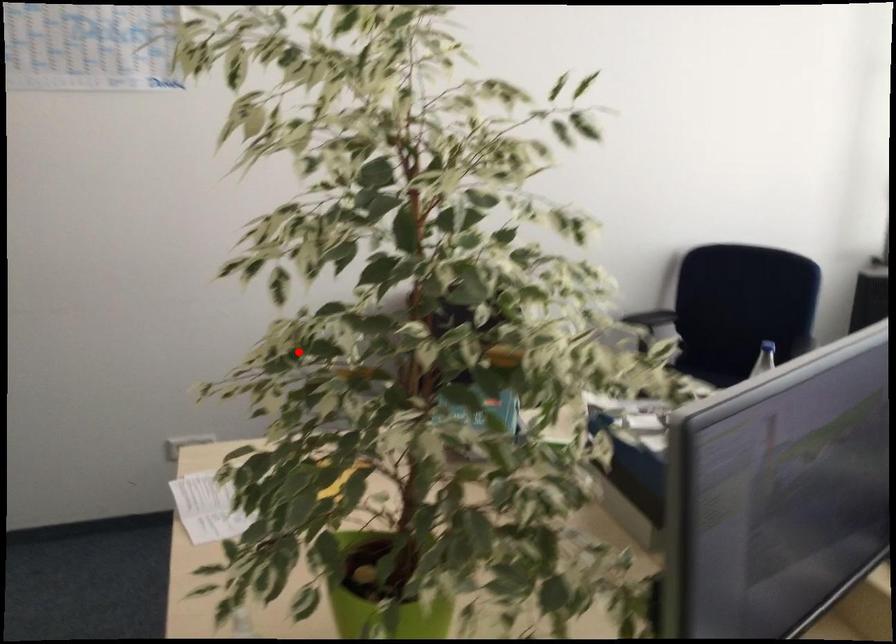
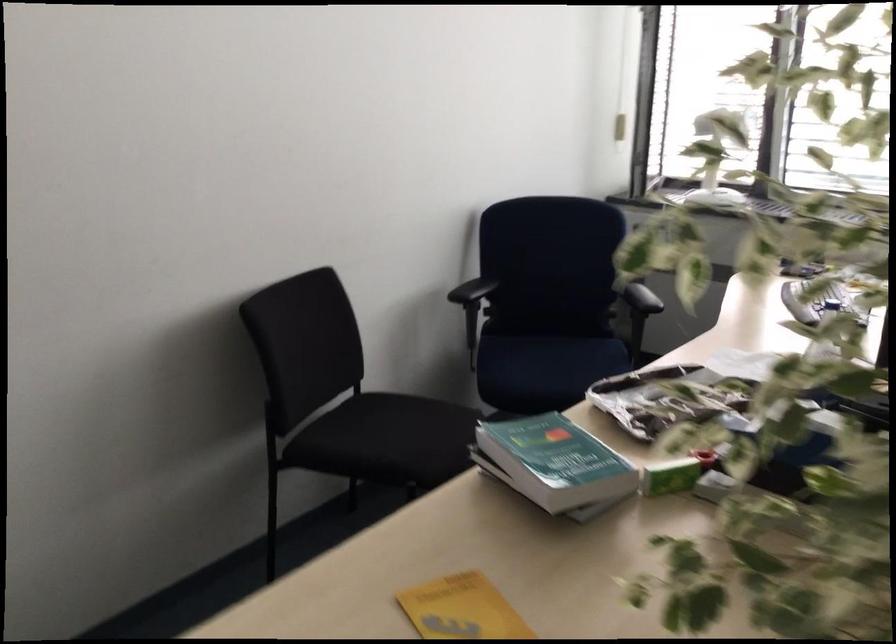
Question: I am providing you with two images of the same scene from different viewpoints. Given a red point in image1, look at the same physical point in image2. Is it:

Choices:
 (A) Closer to the viewpoint
 (B) Farther from the viewpoint

Answer: (A)